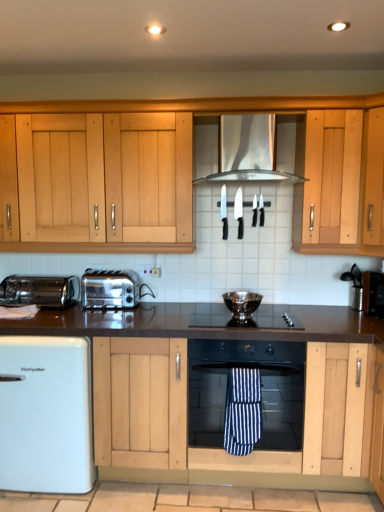
In order to click on black and white striped towel at center in this screenshot , I will do 242,410.

What do you see at coordinates (354, 287) in the screenshot?
I see `brushed metal utensil holder at right, arranged as the 6th appliance when viewed from the left` at bounding box center [354, 287].

Image resolution: width=384 pixels, height=512 pixels. What are the coordinates of `white glossy mini fridge at lower left` in the screenshot? It's located at (46, 415).

At what (x,y) coordinates should I click in order to perform the action: click on silver metallic bowl at center, the second appliance in the left-to-right sequence. Please return your answer as a coordinate pair (x, y). Looking at the image, I should click on (242, 304).

Can you confirm if black plastic knives at center, arranged as the 3th appliance when viewed from the right, is smaller than brushed metal utensil holder at right, arranged as the 6th appliance when viewed from the left?

Indeed, black plastic knives at center, arranged as the 3th appliance when viewed from the right, has a smaller size compared to brushed metal utensil holder at right, arranged as the 6th appliance when viewed from the left.

From the image's perspective, which appliance is the 3rd one below the black plastic knives at center, the 5th appliance positioned from the left? Please provide its 2D coordinates.

[(354, 287)]

Between black plastic knives at center, arranged as the 3th appliance when viewed from the right, and brushed metal utensil holder at right, arranged as the 6th appliance when viewed from the left, which one appears on the left side from the viewer's perspective?

Positioned to the left is black plastic knives at center, arranged as the 3th appliance when viewed from the right.

Is black plastic knives at center, the 5th appliance positioned from the left, wider than brushed metal utensil holder at right, the second appliance positioned from the right?

No, black plastic knives at center, the 5th appliance positioned from the left, is not wider than brushed metal utensil holder at right, the second appliance positioned from the right.

Looking at their sizes, would you say silver metallic toaster at center is wider or thinner than black and white striped towel at center?

Considering their sizes, silver metallic toaster at center looks broader than black and white striped towel at center.

Based on the photo, from their relative heights in the image, would you say silver metallic toaster at center is taller or shorter than black and white striped towel at center?

silver metallic toaster at center is shorter than black and white striped towel at center.

Considering the positions of objects silver metallic toaster at center and black and white striped towel at center in the image provided, who is more to the right, silver metallic toaster at center or black and white striped towel at center?

From the viewer's perspective, black and white striped towel at center appears more on the right side.

Which is nearer, (117,277) or (251,381)?

The point (251,381) is closer.

Which object is more forward, black and white striped towel at center or white glossy mini fridge at lower left?

black and white striped towel at center is more forward.

Considering the relative sizes of black and white striped towel at center and white glossy mini fridge at lower left in the image provided, is black and white striped towel at center bigger than white glossy mini fridge at lower left?

Actually, black and white striped towel at center might be smaller than white glossy mini fridge at lower left.

How distant is black and white striped towel at center from white glossy mini fridge at lower left?

The distance of black and white striped towel at center from white glossy mini fridge at lower left is 90.36 centimeters.

Is black granite countertop at center next to brushed metal utensil holder at right, the second appliance positioned from the right?

There is a gap between black granite countertop at center and brushed metal utensil holder at right, the second appliance positioned from the right.

From a real-world perspective, which object stands above the other?

brushed metal utensil holder at right, arranged as the 6th appliance when viewed from the left, from a real-world perspective.

Does point (154, 311) lie in front of point (353, 280)?

No, it is behind (353, 280).

This screenshot has height=512, width=384. Identify the location of countertop below the brushed metal utensil holder at right, arranged as the 6th appliance when viewed from the left (from the image's perspective). (223, 362).

Is white glossy mini fridge at lower left inside black glass oven at center?

No.

Considering the positions of objects black glass oven at center and white glossy mini fridge at lower left in the image provided, who is more to the left, black glass oven at center or white glossy mini fridge at lower left?

From the viewer's perspective, white glossy mini fridge at lower left appears more on the left side.

Does black glass oven at center have a greater height compared to white glossy mini fridge at lower left?

No, black glass oven at center is not taller than white glossy mini fridge at lower left.

Based on the photo, from a real-world perspective, is metallic black toaster at right, acting as the 7th appliance starting from the left, on top of black plastic knife at center, the fifth appliance in the right-to-left sequence?

No.

Measure the distance between metallic black toaster at right, acting as the 7th appliance starting from the left, and black plastic knife at center, the third appliance in the left-to-right sequence.

metallic black toaster at right, acting as the 7th appliance starting from the left, is 32.82 inches from black plastic knife at center, the third appliance in the left-to-right sequence.

Is metallic black toaster at right, acting as the 7th appliance starting from the left, wider or thinner than black plastic knife at center, the fifth appliance in the right-to-left sequence?

Clearly, metallic black toaster at right, acting as the 7th appliance starting from the left, has more width compared to black plastic knife at center, the fifth appliance in the right-to-left sequence.

Which point is more forward, (374, 291) or (240, 213)?

The point (374, 291) is closer to the camera.

Which of these two, white glossy mini fridge at lower left or silver metallic vent at center, stands taller?

Standing taller between the two is white glossy mini fridge at lower left.

From a real-world perspective, is white glossy mini fridge at lower left above or below silver metallic vent at center?

white glossy mini fridge at lower left is situated lower than silver metallic vent at center in the real world.

Is white glossy mini fridge at lower left positioned beyond the bounds of silver metallic vent at center?

Absolutely, white glossy mini fridge at lower left is external to silver metallic vent at center.

Locate an element on the screen. The height and width of the screenshot is (512, 384). appliance that is the 3rd one below the black plastic knives at center, arranged as the 3th appliance when viewed from the right (from a real-world perspective) is located at coordinates (354, 287).

Locate an element on the screen. This screenshot has height=512, width=384. beach towel in front of the silver metallic toaster at center is located at coordinates (242, 410).

When comparing their distances from silver metallic toaster at center, does metallic black toaster at right, acting as the 7th appliance starting from the left, or silver metallic bowl at center, the second appliance in the left-to-right sequence, seem further?

metallic black toaster at right, acting as the 7th appliance starting from the left, is further to silver metallic toaster at center.

When comparing their distances from black plastic knives at center, which appears as the seventh appliance when viewed from the right, does black plastic knife at center, the fourth appliance positioned from the left, or black granite countertop at center seem closer?

black plastic knife at center, the fourth appliance positioned from the left, is positioned closer to the anchor black plastic knives at center, which appears as the seventh appliance when viewed from the right.

Based on their spatial positions, is brushed metal utensil holder at right, arranged as the 6th appliance when viewed from the left, or black glass oven at center closer to black granite countertop at center?

Based on the image, black glass oven at center appears to be nearer to black granite countertop at center.

Looking at this image, based on their spatial positions, is silver metallic vent at center or black glass oven at center closer to black plastic knife at center, the fourth appliance positioned from the left?

silver metallic vent at center lies closer to black plastic knife at center, the fourth appliance positioned from the left, than the other object.

When comparing their distances from black and white striped towel at center, does black glass gas stove at center or silver metallic toaster at center seem further?

Among the two, silver metallic toaster at center is located further to black and white striped towel at center.

Considering their positions, is black plastic knives at center, arranged as the 3th appliance when viewed from the right, positioned closer to black plastic knife at center, the third appliance in the left-to-right sequence, than brushed metal utensil holder at right, arranged as the 6th appliance when viewed from the left?

black plastic knives at center, arranged as the 3th appliance when viewed from the right, is positioned closer to the anchor black plastic knife at center, the third appliance in the left-to-right sequence.

Based on their spatial positions, is black glass gas stove at center or silver metallic vent at center closer to black and white striped towel at center?

black glass gas stove at center.

Which object lies further to the anchor point brushed metal utensil holder at right, the second appliance positioned from the right, metallic black toaster at right, acting as the 7th appliance starting from the left, or black plastic knives at center, which appears as the seventh appliance when viewed from the right?

The object further to brushed metal utensil holder at right, the second appliance positioned from the right, is black plastic knives at center, which appears as the seventh appliance when viewed from the right.

What are the coordinates of `toaster between metallic silver toaster at left and black plastic knife at center, the 4th appliance in the right-to-left sequence, in the horizontal direction` in the screenshot? It's located at (110, 289).

This screenshot has height=512, width=384. Identify the location of gas stove between white glossy mini fridge at lower left and black plastic knife at center, the fourth appliance positioned from the left, in the horizontal direction. (244, 319).

This screenshot has width=384, height=512. I want to click on gas stove situated between black plastic knives at center, which appears as the seventh appliance when viewed from the right, and brushed metal utensil holder at right, the second appliance positioned from the right, from left to right, so click(244, 319).

Where is `vent between metallic silver toaster at left and black glass gas stove at center in the horizontal direction`? The width and height of the screenshot is (384, 512). vent between metallic silver toaster at left and black glass gas stove at center in the horizontal direction is located at coordinates (251, 168).